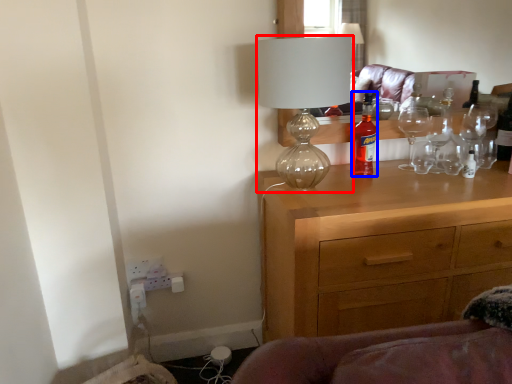
Question: Among these objects, which one is farthest to the camera, lamp (highlighted by a red box) or bottle (highlighted by a blue box)?

Choices:
 (A) lamp
 (B) bottle

Answer: (B)